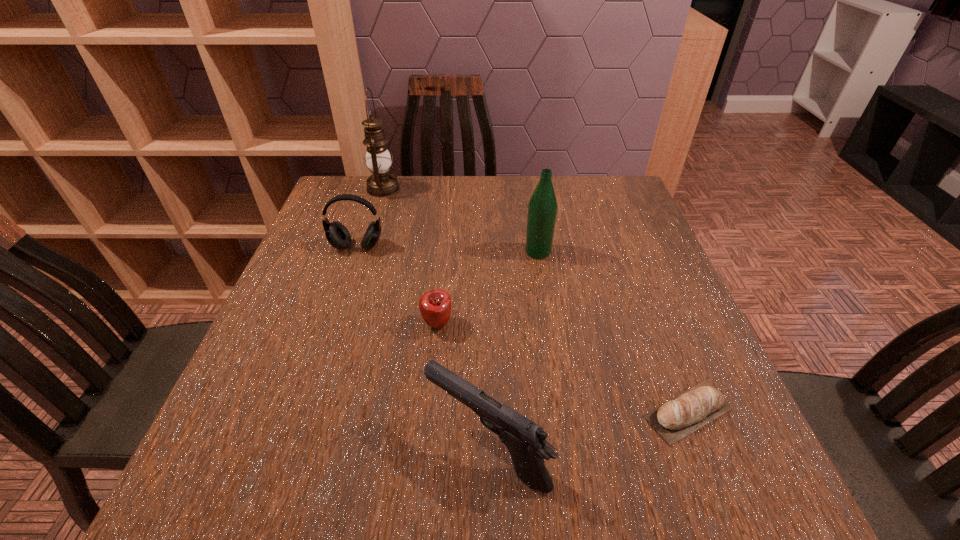
Where is `blank space located 0.240m on the front of the farthest object`? The image size is (960, 540). blank space located 0.240m on the front of the farthest object is located at coordinates (364, 252).

Where is `free space located on the front of the bottle`? The width and height of the screenshot is (960, 540). free space located on the front of the bottle is located at coordinates (556, 363).

Find the location of a particular element. vacant region located on the ear cups of the headset is located at coordinates (310, 386).

Find the location of a particular element. The width and height of the screenshot is (960, 540). free region located at the muzzle of the gun is located at coordinates (305, 448).

Find the location of a particular element. The height and width of the screenshot is (540, 960). free space located at the muzzle of the gun is located at coordinates pyautogui.click(x=256, y=448).

At what (x,y) coordinates should I click in order to perform the action: click on vacant area situated 0.100m at the muzzle of the gun. Please return your answer as a coordinate pair (x, y). The width and height of the screenshot is (960, 540). Looking at the image, I should click on click(366, 448).

Image resolution: width=960 pixels, height=540 pixels. I want to click on vacant space located 0.060m on the front of the fourth farthest object, so click(434, 361).

Locate an element on the screen. The width and height of the screenshot is (960, 540). vacant area situated 0.070m on the left of the pita bread is located at coordinates (601, 411).

The image size is (960, 540). I want to click on object present at the far edge, so click(381, 183).

Locate an element on the screen. The width and height of the screenshot is (960, 540). object present at the near edge is located at coordinates (526, 441).